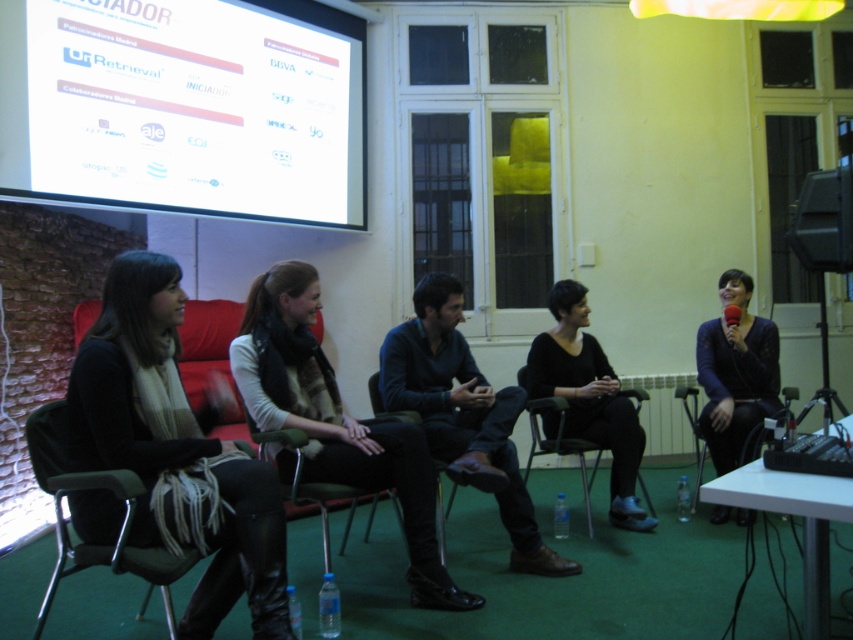
You are an interior designer assessing the seating arrangement in the room. You notice the black leather jacket at left and the black fabric chair at center. Which object is positioned higher relative to the other?

The black leather jacket at left is above the black fabric chair at center, so it is positioned higher.

You are organizing a small event in this room and need to place a decorative pillow on the right side of the black fabric chair at center. Can you place it there without moving the knitted scarf at center?

The knitted scarf at center is positioned on the left side of black fabric chair at center, so placing the decorative pillow on the right side of the black fabric chair at center would be possible without moving the knitted scarf at center.